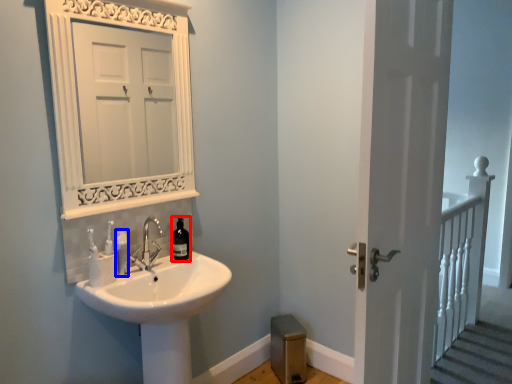
Question: Among these objects, which one is farthest to the camera, bottle (highlighted by a red box) or toiletry (highlighted by a blue box)?

Choices:
 (A) bottle
 (B) toiletry

Answer: (A)